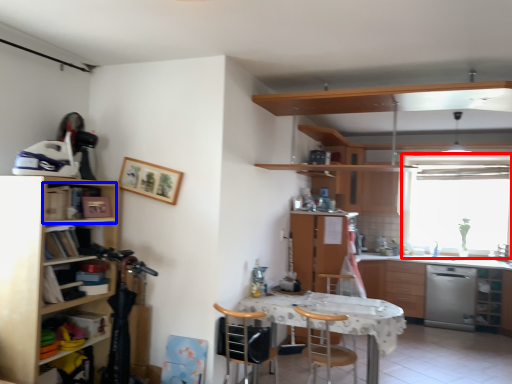
Question: Which object is closer to the camera taking this photo, window (highlighted by a red box) or cabinet (highlighted by a blue box)?

Choices:
 (A) window
 (B) cabinet

Answer: (B)